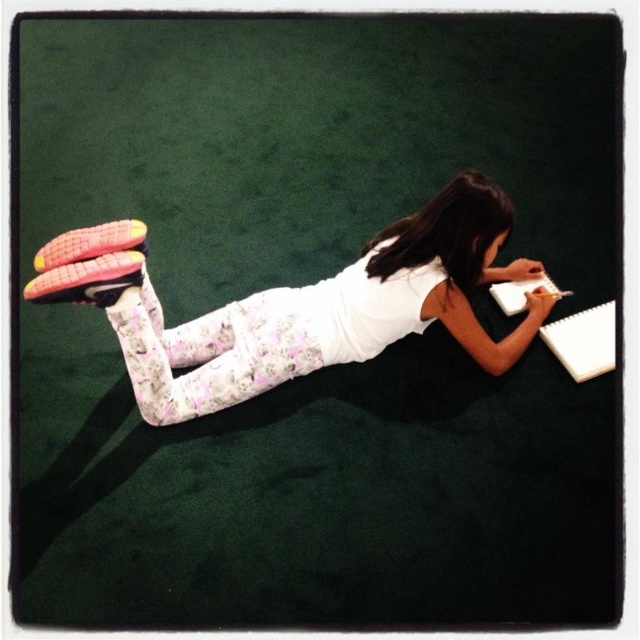
Please provide the 2D coordinates of the pink fabric leggings at upper center in the image. The coordinates should be in the format of a point with two decimal places, such as 0.5,0.5.

The 2D coordinates of the pink fabric leggings at upper center are at point [298,305].

You are a photographer trying to capture the pink fabric leggings at upper center in the image. What are the coordinates of the leggings in the image?

The coordinates of the pink fabric leggings at upper center are at point (298, 305).